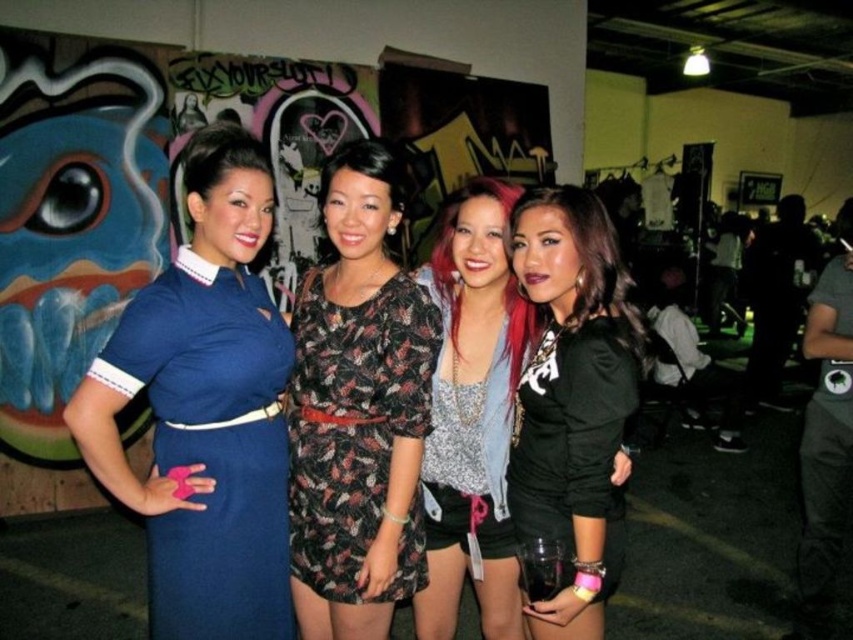
Between black matte shirt at center and floral-patterned fabric dress at center, which one is positioned higher?

black matte shirt at center is above.

Can you confirm if black matte shirt at center is taller than floral-patterned fabric dress at center?

Indeed, black matte shirt at center has a greater height compared to floral-patterned fabric dress at center.

Is point (573, 285) closer to viewer compared to point (334, 595)?

Yes, it is in front of point (334, 595).

This screenshot has height=640, width=853. What are the coordinates of `black matte shirt at center` in the screenshot? It's located at (572, 397).

Does blue fabric dress at left appear under floral-patterned fabric dress at center?

No.

Does blue fabric dress at left have a greater height compared to floral-patterned fabric dress at center?

Yes.

This screenshot has height=640, width=853. Find the location of `blue fabric dress at left`. blue fabric dress at left is located at coordinates (206, 408).

Can you confirm if blue fabric dress at left is shorter than black matte shirt at center?

No, blue fabric dress at left is not shorter than black matte shirt at center.

Does blue fabric dress at left appear on the left side of black matte shirt at center?

Correct, you'll find blue fabric dress at left to the left of black matte shirt at center.

Who is more distant from viewer, (200, 632) or (529, 369)?

The point (529, 369) is more distant.

Locate an element on the screen. This screenshot has height=640, width=853. blue fabric dress at left is located at coordinates (206, 408).